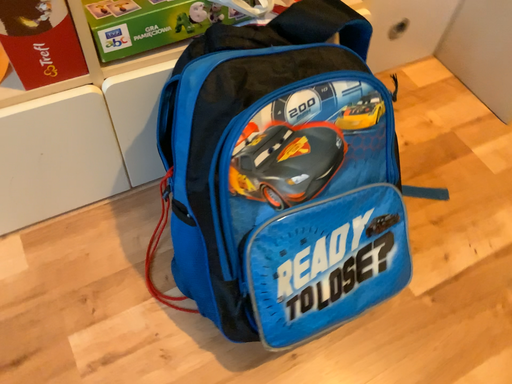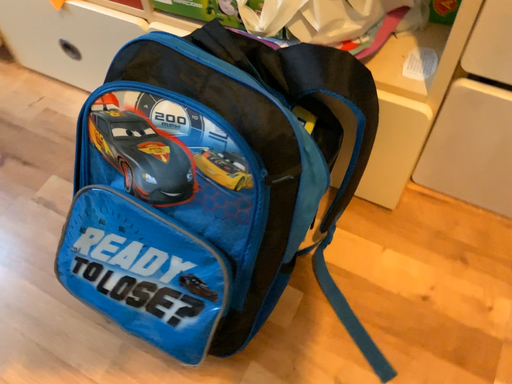
Question: How did the camera likely rotate when shooting the video?

Choices:
 (A) rotated upward
 (B) rotated downward

Answer: (A)